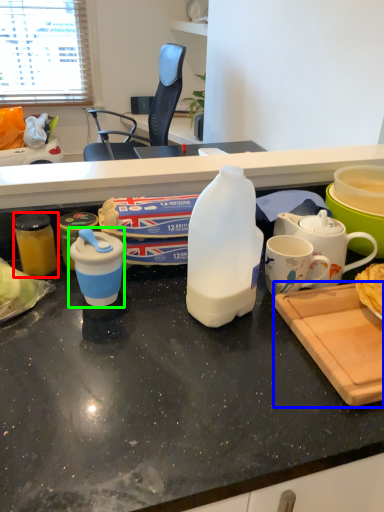
Question: Based on their relative distances, which object is farther from kitchen appliance (highlighted by a red box)? Choose from cutting board (highlighted by a blue box) and coffee cup (highlighted by a green box).

Choices:
 (A) cutting board
 (B) coffee cup

Answer: (A)